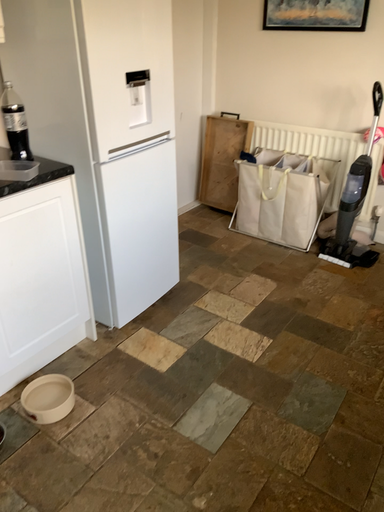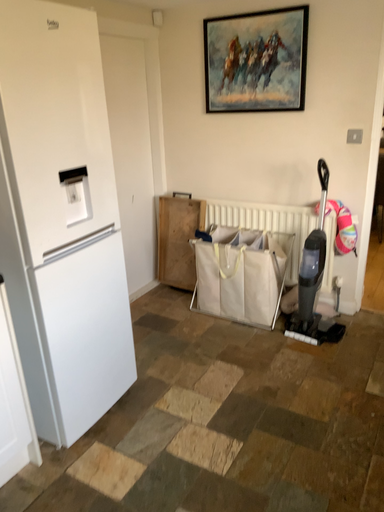
Question: How did the camera likely rotate when shooting the video?

Choices:
 (A) rotated upward
 (B) rotated downward

Answer: (A)